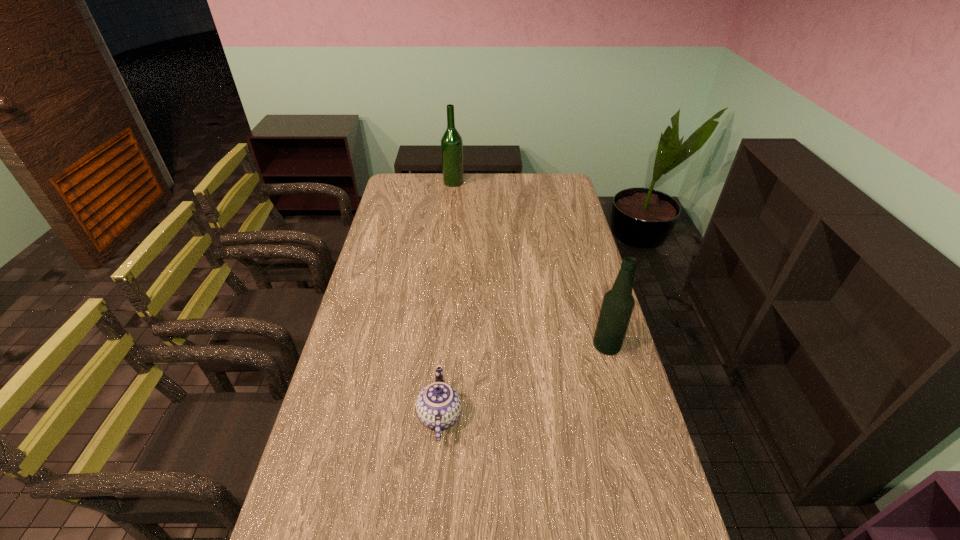
Image resolution: width=960 pixels, height=540 pixels. Find the location of `free space between the farthest object and the chinaware`. free space between the farthest object and the chinaware is located at coordinates (x=446, y=299).

Locate an element on the screen. The height and width of the screenshot is (540, 960). object that can be found as the second closest to the rightmost object is located at coordinates (451, 142).

Where is `the closest object to the farthest object`? the closest object to the farthest object is located at coordinates (618, 303).